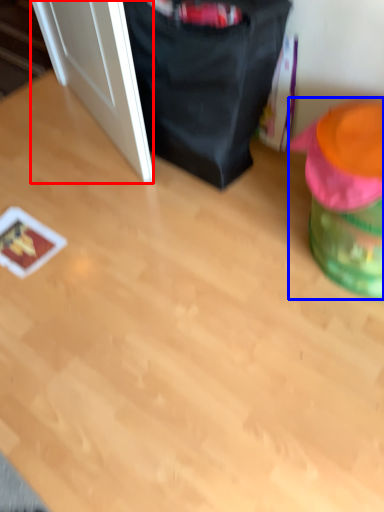
Question: Which object appears closest to the camera in this image, door (highlighted by a red box) or bean bag chair (highlighted by a blue box)?

Choices:
 (A) door
 (B) bean bag chair

Answer: (B)